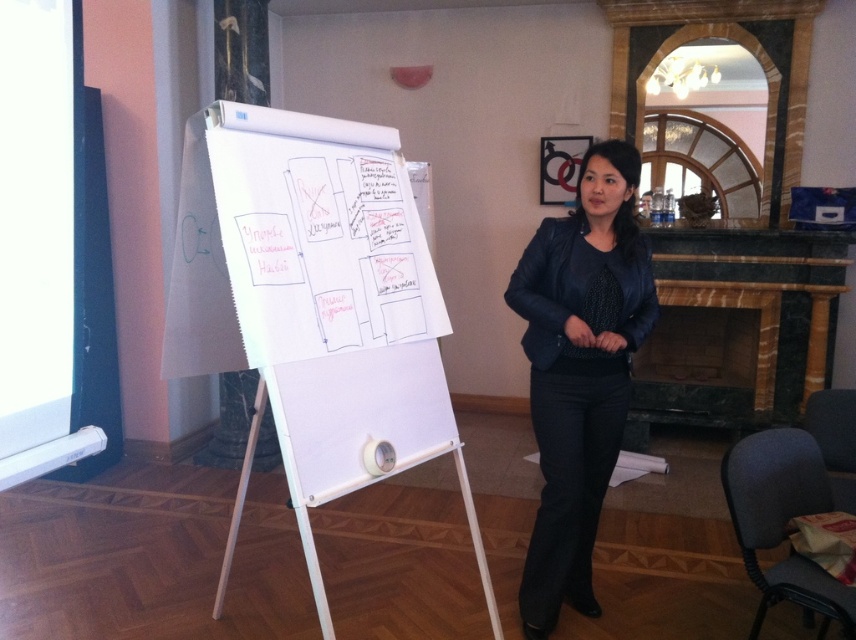
Is white paperboard at center above matte black jacket at center?

No.

Looking at this image, who is positioned more to the right, white paperboard at center or matte black jacket at center?

From the viewer's perspective, matte black jacket at center appears more on the right side.

Identify the location of white paperboard at center. (314, 300).

You are a GUI agent. You are given a task and a screenshot of the screen. Output one action in this format:
    pyautogui.click(x=<x>, y=<y>)
    Task: Click on the white paperboard at center
    
    Given the screenshot: What is the action you would take?
    pyautogui.click(x=314, y=300)